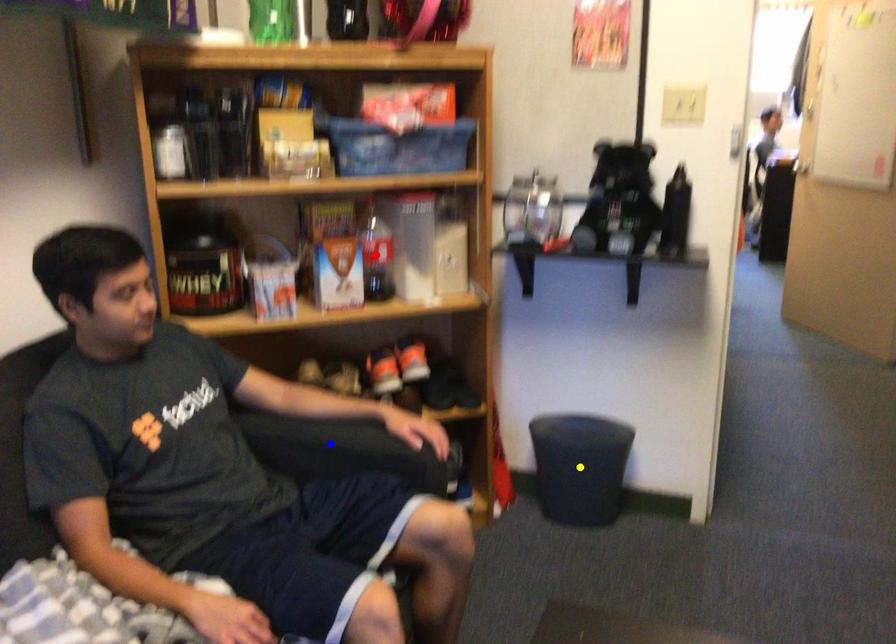
Order these from nearest to farthest:
red point, blue point, yellow point

1. yellow point
2. red point
3. blue point